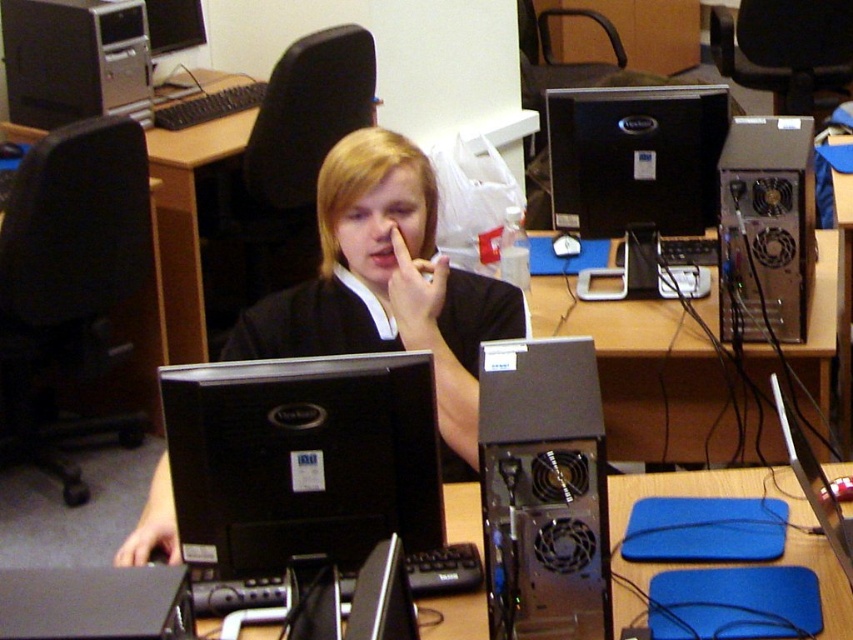
You are standing at the desk in the image and notice two points marked on the desk. The first point is at coordinates point (633, 497) and the second is at point (784, 420). If you were to draw a straight line from your current position to each point, which point would require the line to pass closer to the open computer tower to the right of the monitor?

Point (633, 497) is behind point (784, 420). Since the open computer tower is to the right of the monitor, the line to point (633, 497) would pass closer to the open computer tower because it is positioned behind the other point, which might place it nearer to the tower.